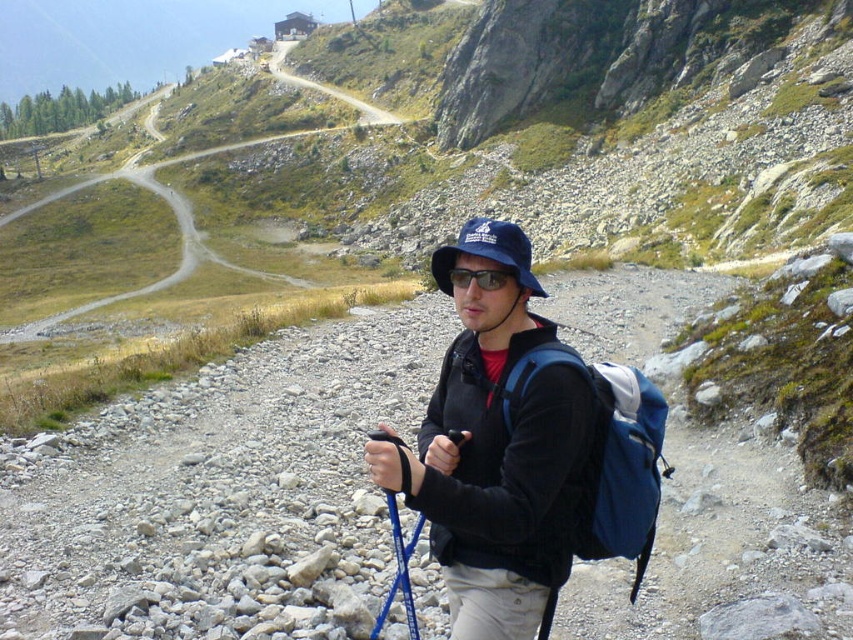
Question: Is matte black jacket at center positioned at the back of blue fabric backpack at center?

Choices:
 (A) no
 (B) yes

Answer: (A)

Question: Which object is farther from the camera taking this photo?

Choices:
 (A) blue fabric backpack at center
 (B) matte black sunglasses at center
 (C) blue fabric baseball hat at center

Answer: (B)

Question: Can you confirm if matte black jacket at center is bigger than blue fabric baseball hat at center?

Choices:
 (A) no
 (B) yes

Answer: (A)

Question: Considering the real-world distances, which object is closest to the matte black jacket at center?

Choices:
 (A) blue fabric backpack at center
 (B) blue fabric baseball hat at center

Answer: (A)

Question: Can you confirm if matte black jacket at center is smaller than blue fabric backpack at center?

Choices:
 (A) no
 (B) yes

Answer: (A)

Question: Estimate the real-world distances between objects in this image. Which object is farther from the blue fabric baseball hat at center?

Choices:
 (A) blue fabric backpack at center
 (B) matte black sunglasses at center
 (C) matte black jacket at center

Answer: (C)